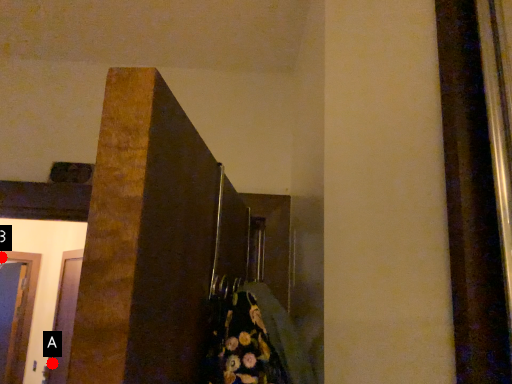
Question: Two points are circled on the image, labeled by A and B beside each circle. Which point is farther to the camera?

Choices:
 (A) A is further
 (B) B is further

Answer: (B)